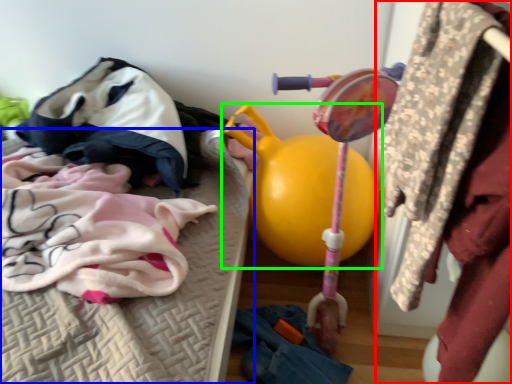
Question: Based on their relative distances, which object is farther from closet (highlighted by a red box)? Choose from furniture (highlighted by a blue box) and toy (highlighted by a green box).

Choices:
 (A) furniture
 (B) toy

Answer: (A)